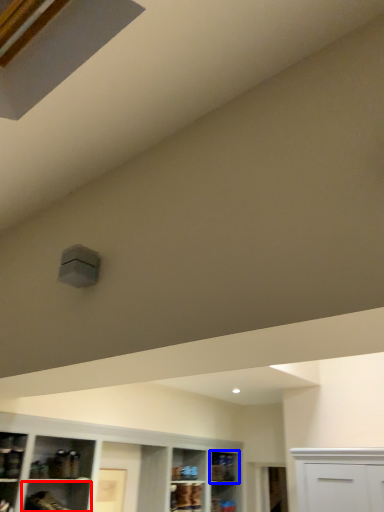
Question: Which object is closer to the camera taking this photo, shelf (highlighted by a red box) or shelf (highlighted by a blue box)?

Choices:
 (A) shelf
 (B) shelf

Answer: (A)